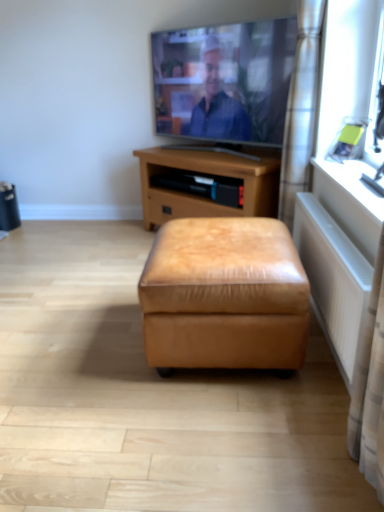
I want to click on white textured radiator at lower right, so click(x=333, y=279).

Identify the location of white textured radiator at lower right. The image size is (384, 512). (333, 279).

How many degrees apart are the facing directions of tan leather ottoman at center and matte silver tv at upper center?

There is a 48.8-degree angle between the facing directions of tan leather ottoman at center and matte silver tv at upper center.

Visually, is tan leather ottoman at center positioned to the left or to the right of matte silver tv at upper center?

From the image, it's evident that tan leather ottoman at center is to the left of matte silver tv at upper center.

From the image's perspective, between tan leather ottoman at center and matte silver tv at upper center, who is located below?

tan leather ottoman at center, from the image's perspective.

Considering the sizes of objects white plastic window sill at right and white textured radiator at lower right in the image provided, who is shorter, white plastic window sill at right or white textured radiator at lower right?

Standing shorter between the two is white plastic window sill at right.

Is white plastic window sill at right spatially inside white textured radiator at lower right, or outside of it?

white plastic window sill at right cannot be found inside white textured radiator at lower right.

Does point (336, 201) lie in front of point (319, 314)?

Yes, it is.

Based on their sizes in the image, would you say tan leather ottoman at center is bigger or smaller than white plastic window sill at right?

Clearly, tan leather ottoman at center is larger in size than white plastic window sill at right.

Is tan leather ottoman at center not within white plastic window sill at right?

tan leather ottoman at center is positioned outside white plastic window sill at right.

Is tan leather ottoman at center to the left of white plastic window sill at right from the viewer's perspective?

Yes.

Find the location of `stool on the left of white plastic window sill at right`. stool on the left of white plastic window sill at right is located at coordinates pyautogui.click(x=224, y=296).

Considering the relative sizes of matte silver tv at upper center and tan leather ottoman at center in the image provided, is matte silver tv at upper center taller than tan leather ottoman at center?

Correct, matte silver tv at upper center is much taller as tan leather ottoman at center.

In terms of width, does matte silver tv at upper center look wider or thinner when compared to tan leather ottoman at center?

matte silver tv at upper center is thinner than tan leather ottoman at center.

Would you say matte silver tv at upper center is inside or outside tan leather ottoman at center?

matte silver tv at upper center is not inside tan leather ottoman at center, it's outside.

How many degrees apart are the facing directions of matte silver tv at upper center and tan leather ottoman at center?

48.8 degrees.

From the picture: Does tan leather ottoman at center turn towards brown leather ottoman at center?

No, tan leather ottoman at center is not oriented towards brown leather ottoman at center.

Which is behind, point (258, 298) or point (276, 200)?

The point (276, 200) is more distant.

Would you say tan leather ottoman at center is inside or outside brown leather ottoman at center?

tan leather ottoman at center cannot be found inside brown leather ottoman at center.

From the picture: From a real-world perspective, is tan leather ottoman at center above or below brown leather ottoman at center?

tan leather ottoman at center is below brown leather ottoman at center.

From a real-world perspective, is white plastic window sill at right located beneath tan leather ottoman at center?

No, from a real-world perspective, white plastic window sill at right is not below tan leather ottoman at center.

Is white plastic window sill at right facing towards tan leather ottoman at center?

No, white plastic window sill at right is not oriented towards tan leather ottoman at center.

In the scene shown: Which object is further away from the camera taking this photo, white plastic window sill at right or tan leather ottoman at center?

tan leather ottoman at center is more distant.

Which point is more distant from viewer, [339,212] or [156,241]?

Point [339,212]

Is brown leather ottoman at center oriented towards white textured radiator at lower right?

No, brown leather ottoman at center is not aimed at white textured radiator at lower right.

From a real-world perspective, is brown leather ottoman at center under white textured radiator at lower right?

Yes, from a real-world perspective, brown leather ottoman at center is under white textured radiator at lower right.

Is brown leather ottoman at center taller than white textured radiator at lower right?

Indeed, brown leather ottoman at center has a greater height compared to white textured radiator at lower right.

Which is in front, point (217, 164) or point (315, 260)?

The point (315, 260) is closer to the camera.

At what (x,y) coordinates should I click in order to perform the action: click on stool below the matte silver tv at upper center (from the image's perspective). Please return your answer as a coordinate pair (x, y). Looking at the image, I should click on (224, 296).

At what (x,y) coordinates should I click in order to perform the action: click on window sill located above the white textured radiator at lower right (from the image's perspective). Please return your answer as a coordinate pair (x, y). The image size is (384, 512). Looking at the image, I should click on (347, 192).

Based on their spatial positions, is brown leather ottoman at center or white plastic window sill at right closer to satin silver curtain at right?

white plastic window sill at right is positioned closer to the anchor satin silver curtain at right.

When comparing their distances from matte silver tv at upper center, does tan leather ottoman at center or white plastic window sill at right seem further?

tan leather ottoman at center is further to matte silver tv at upper center.

Looking at the image, which one is located closer to satin silver curtain at right, white textured radiator at lower right or tan leather ottoman at center?

white textured radiator at lower right lies closer to satin silver curtain at right than the other object.

Based on their spatial positions, is white textured radiator at lower right or brown leather ottoman at center closer to white plastic window sill at right?

white textured radiator at lower right lies closer to white plastic window sill at right than the other object.

Estimate the real-world distances between objects in this image. Which object is closer to satin silver curtain at right, brown leather ottoman at center or white textured radiator at lower right?

Among the two, brown leather ottoman at center is located nearer to satin silver curtain at right.

When comparing their distances from brown leather ottoman at center, does matte silver tv at upper center or white textured radiator at lower right seem further?

Among the two, white textured radiator at lower right is located further to brown leather ottoman at center.

Estimate the real-world distances between objects in this image. Which object is closer to white textured radiator at lower right, brown leather ottoman at center or tan leather ottoman at center?

tan leather ottoman at center lies closer to white textured radiator at lower right than the other object.

When comparing their distances from tan leather ottoman at center, does brown leather ottoman at center or satin silver curtain at right seem closer?

satin silver curtain at right is closer to tan leather ottoman at center.

Identify the location of nightstand between matte silver tv at upper center and tan leather ottoman at center from top to bottom. (205, 185).

Find the location of a particular element. This screenshot has width=384, height=512. curtain between white textured radiator at lower right and brown leather ottoman at center along the z-axis is located at coordinates (301, 109).

Image resolution: width=384 pixels, height=512 pixels. Find the location of `curtain between matte silver tv at upper center and white textured radiator at lower right in the up-down direction`. curtain between matte silver tv at upper center and white textured radiator at lower right in the up-down direction is located at coordinates (301, 109).

Image resolution: width=384 pixels, height=512 pixels. In order to click on radiator that lies between satin silver curtain at right and tan leather ottoman at center from top to bottom in this screenshot , I will do `click(333, 279)`.